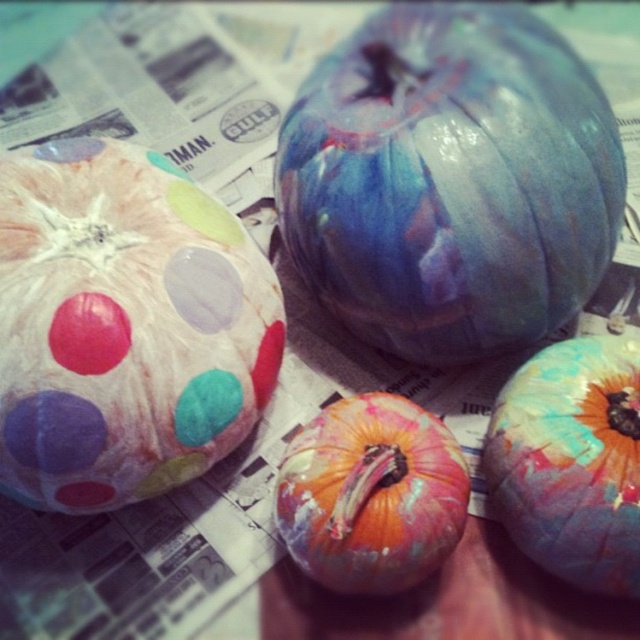
Consider the image. You are an artist planning to place a small decorative item between the marbled blue pumpkin at center and the multicolored painted pumpkin at center. Which pumpkin has a larger width to ensure the item fits properly?

The marbled blue pumpkin at center has a larger width than the multicolored painted pumpkin at center, so placing the item between them should accommodate the space.